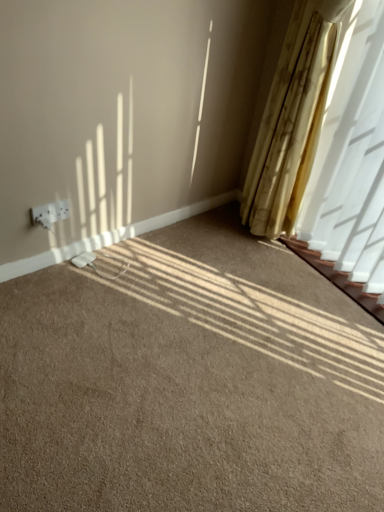
Question: In terms of size, does brown carpet at center appear bigger or smaller than yellow textured curtain at right?

Choices:
 (A) small
 (B) big

Answer: (B)

Question: Based on their positions, is brown carpet at center located to the left or right of yellow textured curtain at right?

Choices:
 (A) right
 (B) left

Answer: (B)

Question: Which object is the closest to the white plastic outlet at lower left?

Choices:
 (A) brown carpet at center
 (B) yellow textured curtain at right

Answer: (A)

Question: Which object is positioned closest to the brown carpet at center?

Choices:
 (A) yellow textured curtain at right
 (B) white plastic outlet at lower left

Answer: (B)